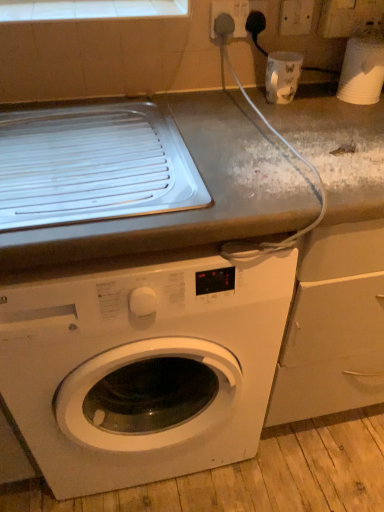
Question: Is white glossy cup at upper right, acting as the first appliance starting from the left, aimed at white tile at upper center?

Choices:
 (A) yes
 (B) no

Answer: (B)

Question: Is white glossy cup at upper right, arranged as the 2th appliance when viewed from the right, closer to the viewer compared to white tile at upper center?

Choices:
 (A) yes
 (B) no

Answer: (B)

Question: Is white glossy cup at upper right, acting as the first appliance starting from the left, completely or partially outside of white tile at upper center?

Choices:
 (A) yes
 (B) no

Answer: (A)

Question: Can you confirm if white glossy cup at upper right, arranged as the 2th appliance when viewed from the right, is positioned to the right of white tile at upper center?

Choices:
 (A) no
 (B) yes

Answer: (B)

Question: Can you confirm if white glossy cup at upper right, acting as the first appliance starting from the left, is shorter than white tile at upper center?

Choices:
 (A) yes
 (B) no

Answer: (B)

Question: In the image, is white plastic electric outlet at upper right, which is the 2th electric outlet in left-to-right order, positioned in front of or behind white glossy washing machine at center?

Choices:
 (A) front
 (B) behind

Answer: (B)

Question: Is white plastic electric outlet at upper right, which is the 2th electric outlet in left-to-right order, wider or thinner than white glossy washing machine at center?

Choices:
 (A) thin
 (B) wide

Answer: (A)

Question: In terms of height, does white plastic electric outlet at upper right, which is the first electric outlet from right to left, look taller or shorter compared to white glossy washing machine at center?

Choices:
 (A) tall
 (B) short

Answer: (B)

Question: Based on their sizes in the image, would you say white plastic electric outlet at upper right, which is the 2th electric outlet in left-to-right order, is bigger or smaller than white glossy washing machine at center?

Choices:
 (A) big
 (B) small

Answer: (B)

Question: Would you say white plastic cup at upper right, the 2th appliance in the left-to-right sequence, is to the left or to the right of white glossy cup at upper right, acting as the first appliance starting from the left, in the picture?

Choices:
 (A) right
 (B) left

Answer: (A)

Question: In the image, is white plastic cup at upper right, the 2th appliance in the left-to-right sequence, positioned in front of or behind white glossy cup at upper right, acting as the first appliance starting from the left?

Choices:
 (A) front
 (B) behind

Answer: (A)

Question: From the image's perspective, is white plastic cup at upper right, which appears as the first appliance when viewed from the right, positioned above or below white glossy cup at upper right, acting as the first appliance starting from the left?

Choices:
 (A) above
 (B) below

Answer: (A)

Question: Would you say white plastic cup at upper right, the 2th appliance in the left-to-right sequence, is inside or outside white glossy cup at upper right, arranged as the 2th appliance when viewed from the right?

Choices:
 (A) outside
 (B) inside

Answer: (A)

Question: Is white plastic electric outlet at upper right, which is the 2th electric outlet in left-to-right order, taller or shorter than white tile at upper center?

Choices:
 (A) short
 (B) tall

Answer: (B)

Question: Would you say white plastic electric outlet at upper right, which is the first electric outlet from right to left, is inside or outside white tile at upper center?

Choices:
 (A) inside
 (B) outside

Answer: (B)